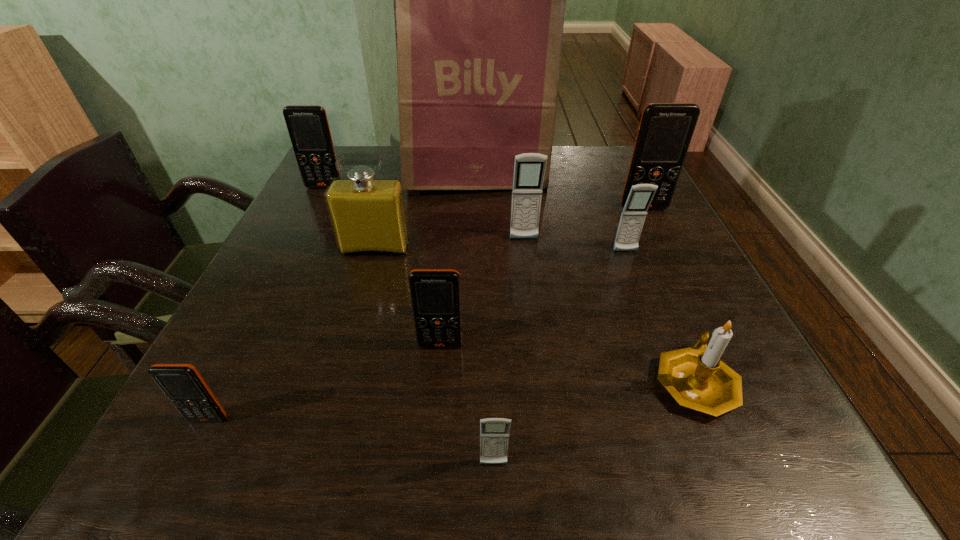
Locate an element on the screen. Image resolution: width=960 pixels, height=540 pixels. the second smallest orange cellular telephone is located at coordinates (435, 294).

At what (x,y) coordinates should I click in order to perform the action: click on the fifth farthest cellular telephone. Please return your answer as a coordinate pair (x, y). Looking at the image, I should click on (435, 294).

At what (x,y) coordinates should I click in order to perform the action: click on candle holder. Please return your answer as a coordinate pair (x, y). The image size is (960, 540). Looking at the image, I should click on (697, 379).

Identify the location of the smallest orange cellular telephone. Image resolution: width=960 pixels, height=540 pixels. (182, 383).

Image resolution: width=960 pixels, height=540 pixels. What are the coordinates of `the nearest orange cellular telephone` in the screenshot? It's located at (182, 383).

Locate an element on the screen. the leftmost gray cellular telephone is located at coordinates (494, 432).

Where is `the smallest gray cellular telephone`? the smallest gray cellular telephone is located at coordinates (494, 432).

The width and height of the screenshot is (960, 540). I want to click on vacant space located on the front-facing side of the tallest object, so click(474, 211).

Locate an element on the screen. The image size is (960, 540). vacant space situated 0.280m on the screen of the second tallest object is located at coordinates (684, 287).

Locate an element on the screen. blank space located on the front-facing side of the perfume is located at coordinates (367, 278).